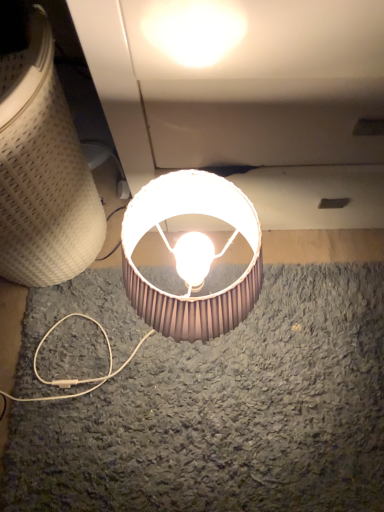
Question: In terms of size, does matte brown lampshade at lower center, acting as the second lamp starting from the right, appear bigger or smaller than brown pleated lampshade at center, arranged as the second lamp when viewed from the left?

Choices:
 (A) big
 (B) small

Answer: (A)

Question: From the image's perspective, is matte brown lampshade at lower center, marked as the 1th lamp in a left-to-right arrangement, above or below brown pleated lampshade at center, arranged as the second lamp when viewed from the left?

Choices:
 (A) below
 (B) above

Answer: (B)

Question: From a real-world perspective, is matte brown lampshade at lower center, marked as the 1th lamp in a left-to-right arrangement, physically located above or below brown pleated lampshade at center, arranged as the second lamp when viewed from the left?

Choices:
 (A) above
 (B) below

Answer: (A)

Question: Considering the positions of brown pleated lampshade at center, arranged as the second lamp when viewed from the left, and matte brown lampshade at lower center, acting as the second lamp starting from the right, in the image, is brown pleated lampshade at center, arranged as the second lamp when viewed from the left, wider or thinner than matte brown lampshade at lower center, acting as the second lamp starting from the right,?

Choices:
 (A) thin
 (B) wide

Answer: (A)

Question: In the image, is brown pleated lampshade at center, which is the 1th lamp from right to left, on the left side or the right side of matte brown lampshade at lower center, marked as the 1th lamp in a left-to-right arrangement?

Choices:
 (A) right
 (B) left

Answer: (A)

Question: From a real-world perspective, relative to matte brown lampshade at lower center, marked as the 1th lamp in a left-to-right arrangement, is brown pleated lampshade at center, arranged as the second lamp when viewed from the left, vertically above or below?

Choices:
 (A) above
 (B) below

Answer: (B)

Question: Looking at the image, does brown pleated lampshade at center, which is the 1th lamp from right to left, seem bigger or smaller compared to matte brown lampshade at lower center, marked as the 1th lamp in a left-to-right arrangement?

Choices:
 (A) big
 (B) small

Answer: (B)